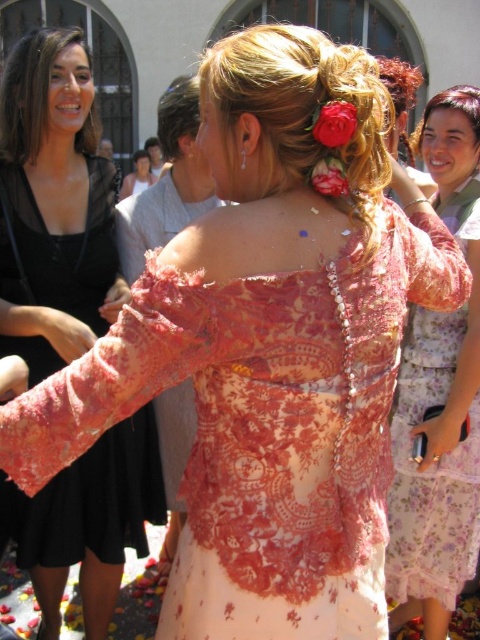
Based on the photo, you are a photographer at the event and need to capture a closeup shot of both the blonde silky hair at upper right and the pink fabric flower at upper center in a single frame. Given that your camera has a focal length of 50mm, can you estimate if they can be captured together without moving the camera?

The blonde silky hair at upper right and pink fabric flower at upper center are 22.90 feet apart. At 50mm focal length, the camera can capture objects within a certain distance in the frame. However, 22.90 feet is quite a large distance, so it might be challenging to capture both in a single frame without moving the camera. It would depend on the camera sensor size and the specific angle of view, but generally, this distance may require a wider lens or repositioning.

You are a photographer at the event and want to capture a closeup of the floral lace dress at center and dark brown silky hair at upper left. Which object should you focus on first if you want to ensure both are in frame without moving the camera?

The floral lace dress at center should be focused on first because it is larger in size than the dark brown silky hair at upper left, making it easier to center in the frame while still capturing the smaller object within the same shot.